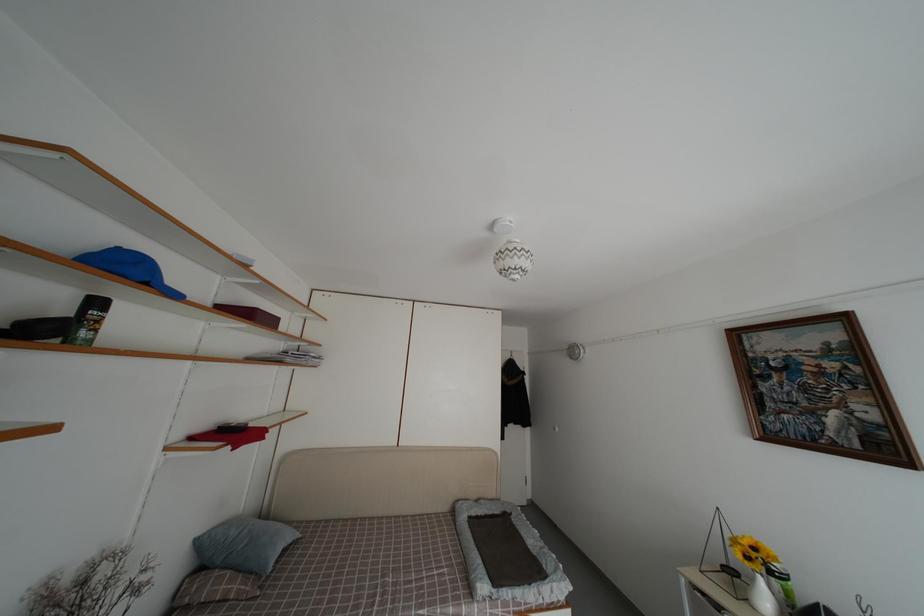
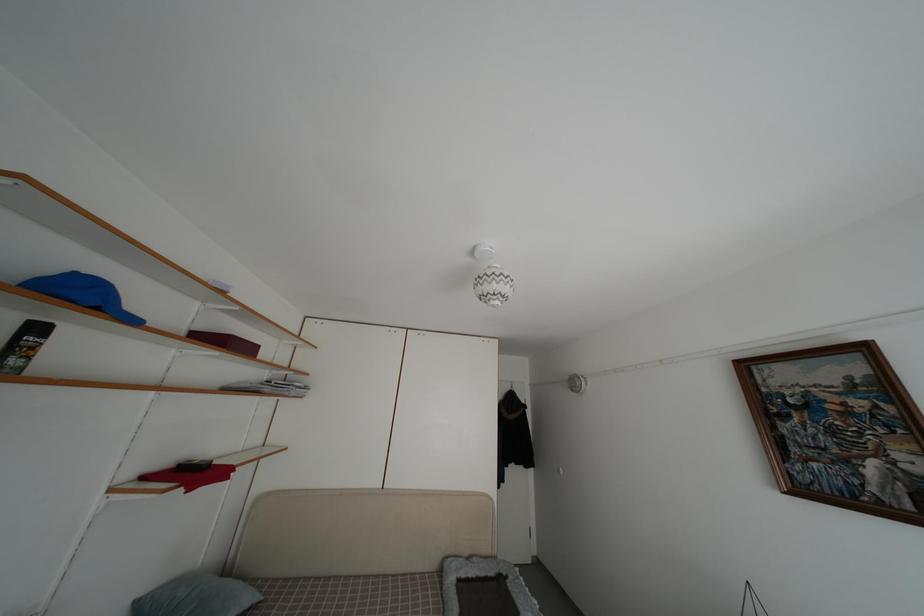
Where in the second image is the point corresponding to point 103,310 from the first image?

(43, 334)